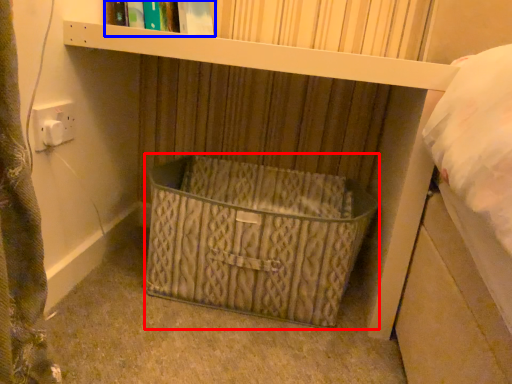
Question: Which point is closer to the camera, basket (highlighted by a red box) or book (highlighted by a blue box)?

Choices:
 (A) basket
 (B) book

Answer: (A)